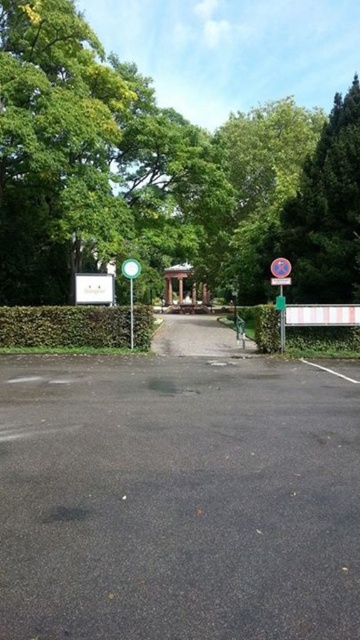
Question: Does green hedge at right come behind metallic circular stop sign at center?

Choices:
 (A) no
 (B) yes

Answer: (A)

Question: Is green leafy tree at upper center positioned behind green plastic pole at center?

Choices:
 (A) yes
 (B) no

Answer: (A)

Question: Which point is farther to the camera?

Choices:
 (A) (281, 317)
 (B) (131, 296)
 (C) (38, 32)

Answer: (C)

Question: Is green leafy hedge at center thinner than green plastic signpost at center?

Choices:
 (A) no
 (B) yes

Answer: (A)

Question: Which object is positioned closest to the metallic circular sign at right?

Choices:
 (A) metallic round sign at center
 (B) green leafy tree at upper center
 (C) green hedge at right
 (D) black asphalt parking lot at center

Answer: (A)

Question: Which is farther from the green plastic signpost at center?

Choices:
 (A) green glossy circle at center
 (B) green hedge at right

Answer: (B)